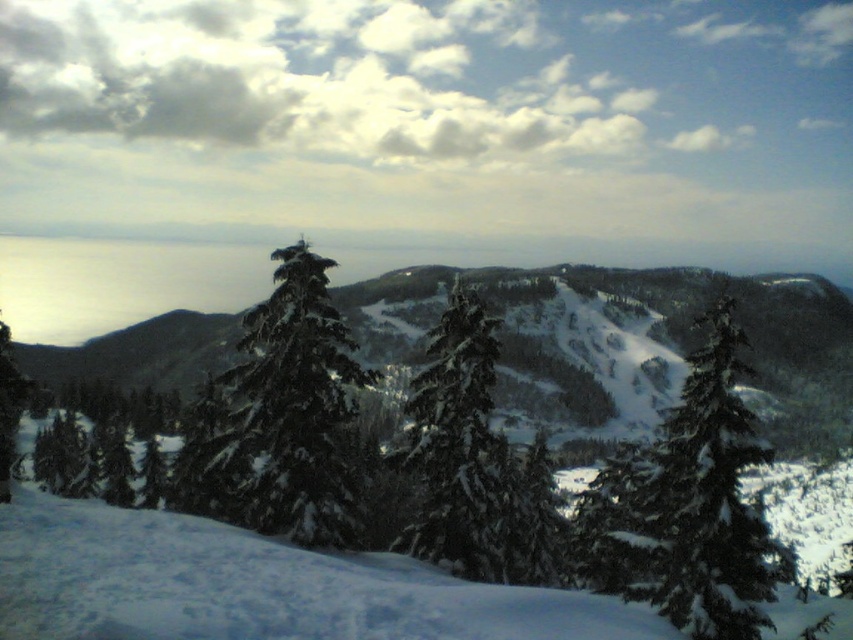
Looking at this image, you are planning to take a photo of the green matte tree at center and the green matte evergreen tree at center. Which tree should you focus on if you want to capture the wider one in your shot?

The green matte tree at center is wider than the green matte evergreen tree at center, so you should focus on the green matte tree at center to capture the wider one in your shot.

You are planning to set up a temporary tent between the green matte tree at center and the green matte evergreen tree at center. The tent requires a minimum of 20 meters of space between the two trees to be safely anchored. Based on the scene description, can the tent be safely anchored between these two trees?

The distance between the green matte tree at center and the green matte evergreen tree at center is 21.35 meters, which exceeds the required 20 meters. Therefore, the tent can be safely anchored between them.